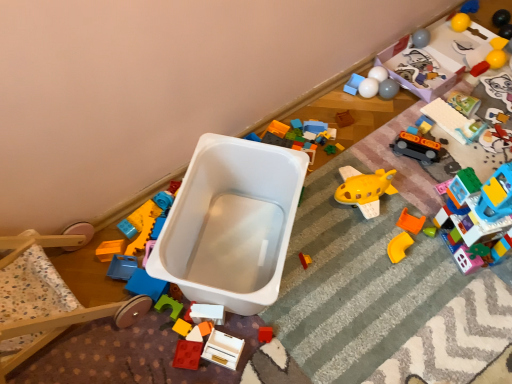
Image resolution: width=512 pixels, height=384 pixels. I want to click on vacant location behind orange plastic block at lower right, placed as the 10th toy when sorted from left to right, so click(x=404, y=179).